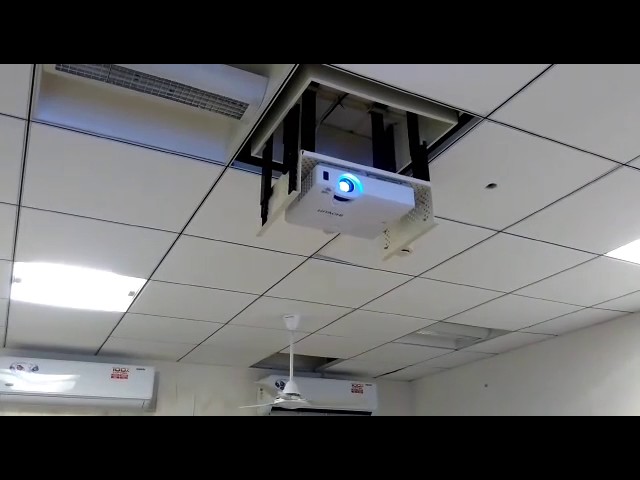
Locate an element on the screen. The width and height of the screenshot is (640, 480). fan blades is located at coordinates (316, 405), (272, 405), (269, 390).